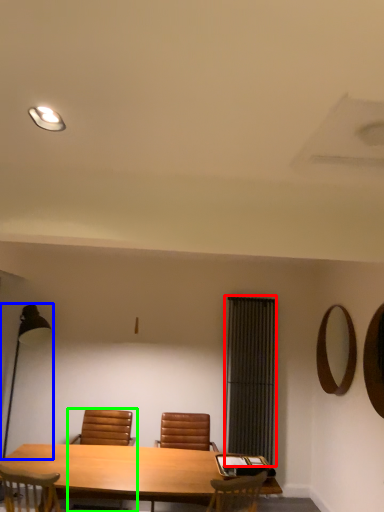
Question: Which object is the farthest from curtain (highlighted by a red box)? Choose among these: table lamp (highlighted by a blue box) or chair (highlighted by a green box).

Choices:
 (A) table lamp
 (B) chair

Answer: (A)